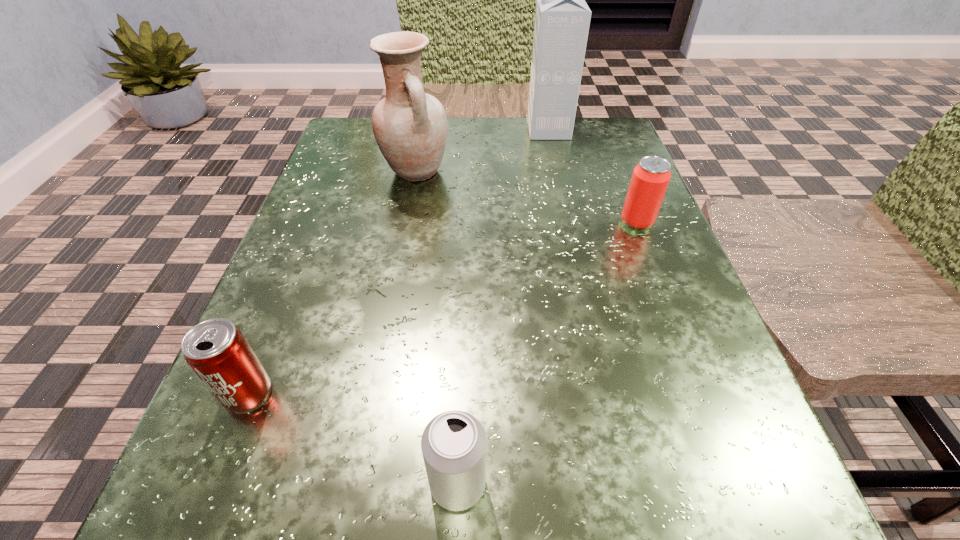
The image size is (960, 540). Identify the location of free space between the farthest beer can and the second nearest beer can. pos(443,308).

Identify the location of vacant area that lies between the rightmost object and the tallest object. The image size is (960, 540). [592, 176].

Where is `free space between the pottery and the fourth farthest object`? free space between the pottery and the fourth farthest object is located at coordinates pos(332,283).

Locate an element on the screen. blank region between the pottery and the second farthest beer can is located at coordinates (332, 283).

Identify which object is the third closest to the rightmost beer can. Please provide its 2D coordinates. Your answer should be formatted as a tuple, i.e. [(x, y)], where the tuple contains the x and y coordinates of a point satisfying the conditions above.

[(453, 444)]

I want to click on the second closest object relative to the pottery, so click(x=650, y=178).

Locate which beer can is the second closest to the leftmost object. Please provide its 2D coordinates. Your answer should be formatted as a tuple, i.e. [(x, y)], where the tuple contains the x and y coordinates of a point satisfying the conditions above.

[(650, 178)]

Locate an element on the screen. the closest beer can to the farthest object is located at coordinates (650, 178).

Where is `free spot that satisfies the following two spatial constraints: 1. on the front label of the fourth object from left to right; 2. on the back side of the rightmost object`? The width and height of the screenshot is (960, 540). free spot that satisfies the following two spatial constraints: 1. on the front label of the fourth object from left to right; 2. on the back side of the rightmost object is located at coordinates (569, 222).

Find the location of `free spot that satisfies the following two spatial constraints: 1. on the front label of the fourth object from left to right; 2. on the back side of the rightmost beer can`. free spot that satisfies the following two spatial constraints: 1. on the front label of the fourth object from left to right; 2. on the back side of the rightmost beer can is located at coordinates (569, 222).